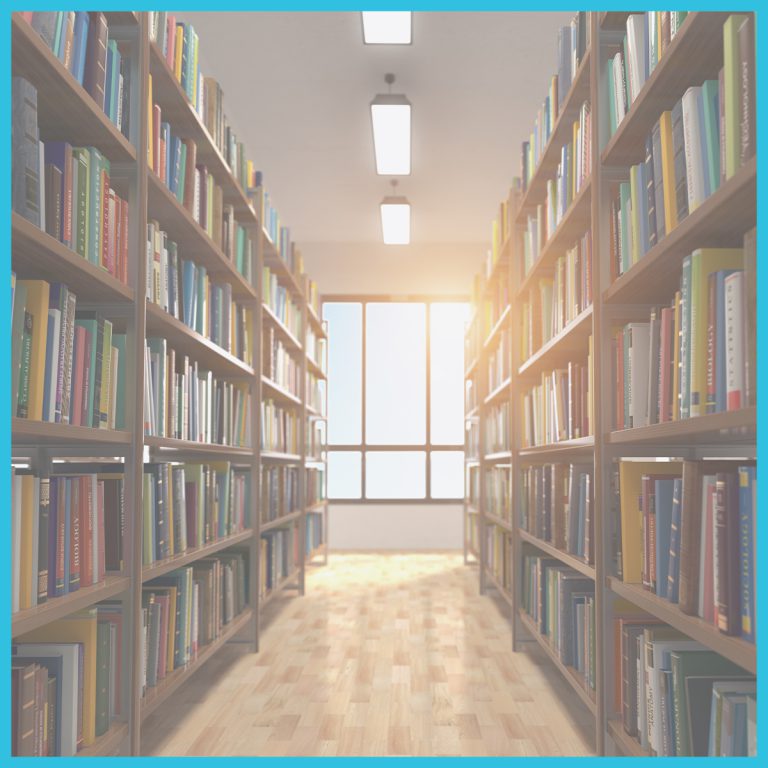
Find the location of `windows`. windows is located at coordinates (353, 465), (346, 409), (376, 404), (379, 447), (438, 467), (431, 401).